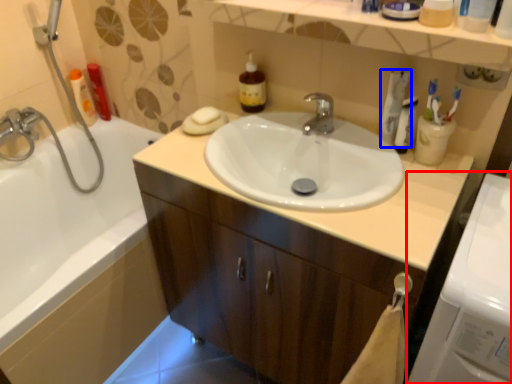
Question: Which object appears farthest to the camera in this image, washing machine (highlighted by a red box) or toothpaste (highlighted by a blue box)?

Choices:
 (A) washing machine
 (B) toothpaste

Answer: (B)